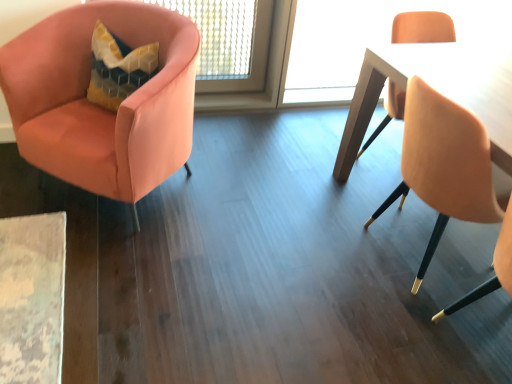
Locate an element on the screen. vacant area that is in front of satin pink armchair at left, acting as the 2th chair starting from the right is located at coordinates (98, 274).